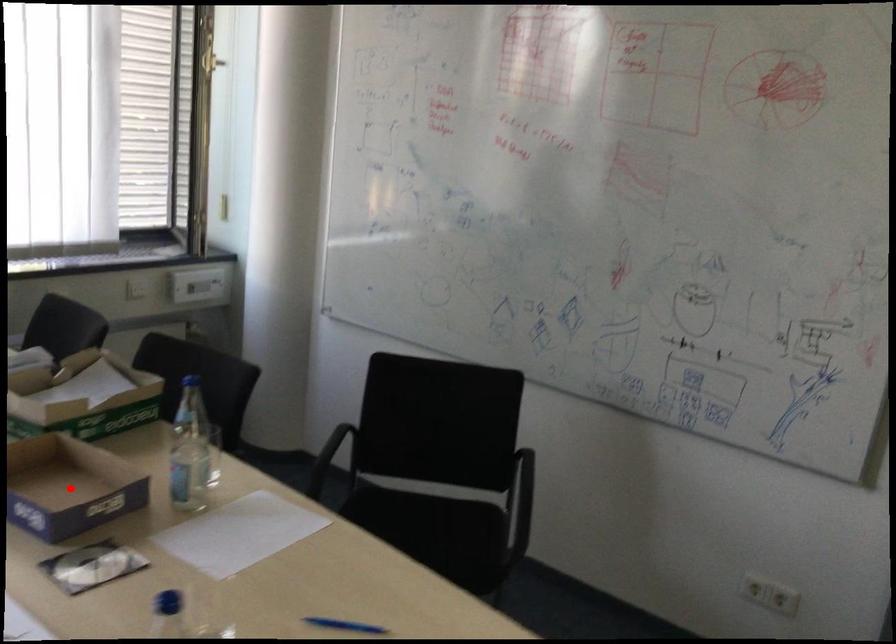
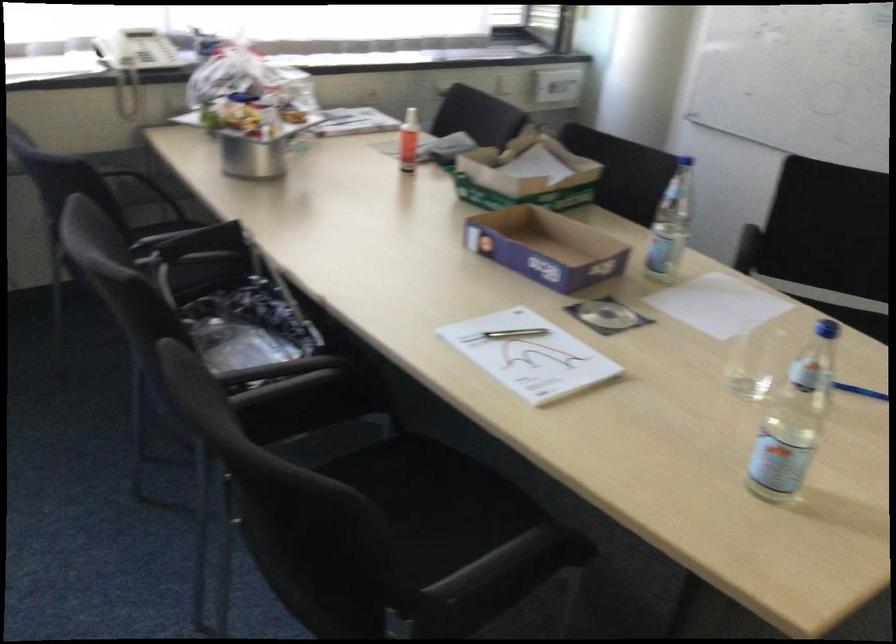
In the second image, find the point that corresponds to the highlighted location in the first image.

(546, 247)